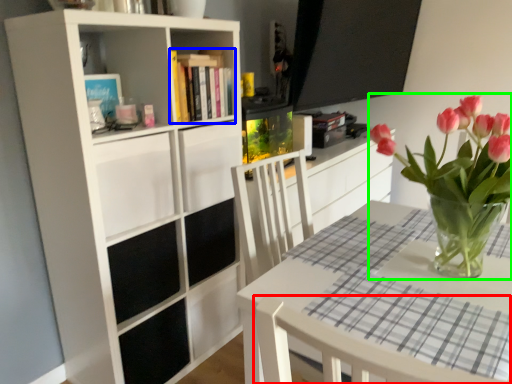
Question: Which object is the closest to the chair (highlighted by a red box)? Choose among these: book (highlighted by a blue box) or houseplant (highlighted by a green box).

Choices:
 (A) book
 (B) houseplant

Answer: (B)